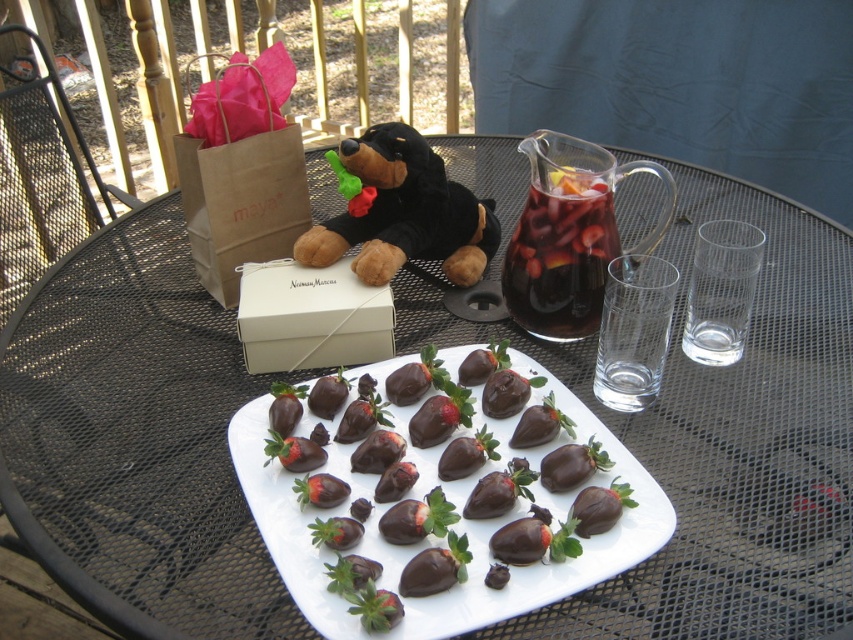
How far apart are chocolate-coated strawberries at center and black plush bear at center?

chocolate-coated strawberries at center is 8.45 inches away from black plush bear at center.

Does point (543, 529) lie behind point (473, 216)?

No, it is in front of (473, 216).

What do you see at coordinates (444, 518) in the screenshot? I see `chocolate-coated strawberries at center` at bounding box center [444, 518].

The width and height of the screenshot is (853, 640). I want to click on chocolate-coated strawberries at center, so click(x=444, y=518).

Does chocolate-coated strawberries at center have a lesser width compared to dark glass pitcher at upper center?

No, chocolate-coated strawberries at center is not thinner than dark glass pitcher at upper center.

Is chocolate-coated strawberries at center to the left of dark glass pitcher at upper center from the viewer's perspective?

Indeed, chocolate-coated strawberries at center is positioned on the left side of dark glass pitcher at upper center.

Is point (384, 570) positioned behind point (585, 323)?

No.

Locate an element on the screen. This screenshot has height=640, width=853. chocolate-coated strawberries at center is located at coordinates (444, 518).

Does black plush bear at center appear on the left side of dark glass pitcher at upper center?

Correct, you'll find black plush bear at center to the left of dark glass pitcher at upper center.

Who is positioned more to the right, black plush bear at center or dark glass pitcher at upper center?

dark glass pitcher at upper center is more to the right.

Does point (393, 212) come behind point (578, 262)?

Yes.

Image resolution: width=853 pixels, height=640 pixels. I want to click on black plush bear at center, so click(x=404, y=212).